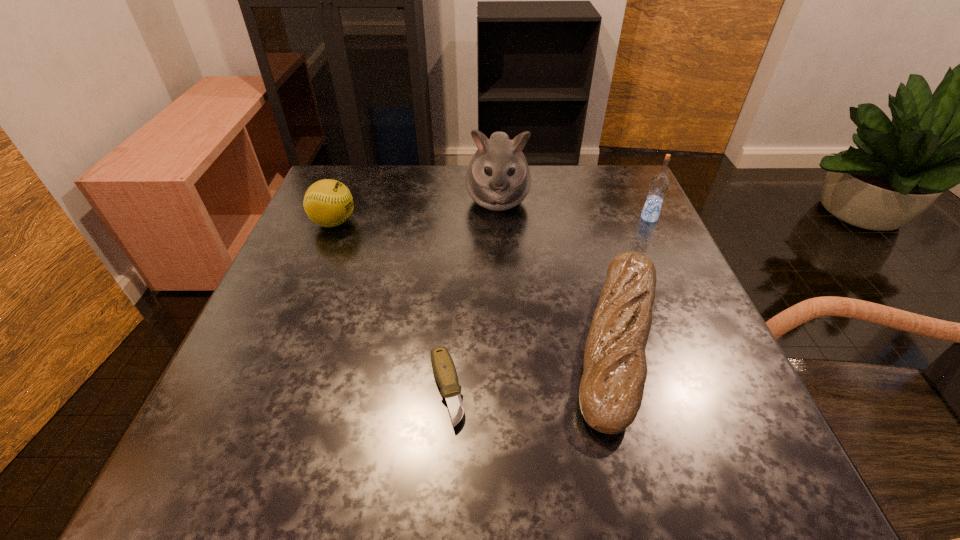
Find the location of a particular element. The width and height of the screenshot is (960, 540). hamster is located at coordinates (498, 178).

Locate an element on the screen. Image resolution: width=960 pixels, height=540 pixels. vodka is located at coordinates (659, 184).

The width and height of the screenshot is (960, 540). In order to click on the fourth shortest object in this screenshot , I will do `click(659, 184)`.

Find the location of `the third shortest object`. the third shortest object is located at coordinates (328, 203).

Locate an element on the screen. the leftmost object is located at coordinates (328, 203).

Locate an element on the screen. baguet is located at coordinates (611, 390).

Where is `the second shortest object`? the second shortest object is located at coordinates (611, 390).

This screenshot has width=960, height=540. I want to click on pocketknife, so click(444, 370).

You are a GUI agent. You are given a task and a screenshot of the screen. Output one action in this format:
    pyautogui.click(x=<x>, y=<y>)
    Task: Click on the vacant region located on the face of the hamster
    This screenshot has width=960, height=540.
    Given the screenshot: What is the action you would take?
    pyautogui.click(x=502, y=283)

This screenshot has width=960, height=540. I want to click on free region located on the left of the rightmost object, so click(x=593, y=218).